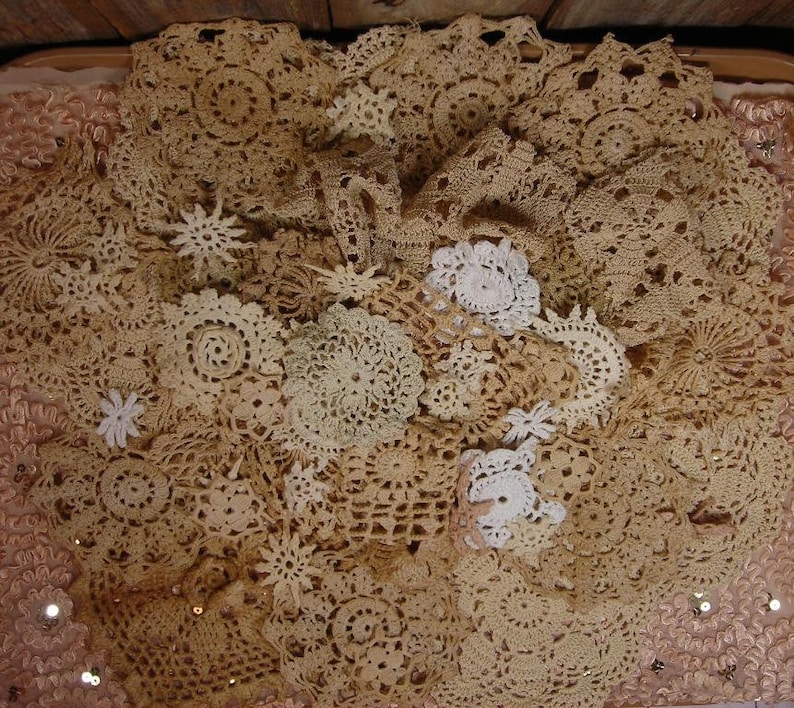
Where is `brown doily`? brown doily is located at coordinates (125, 512).